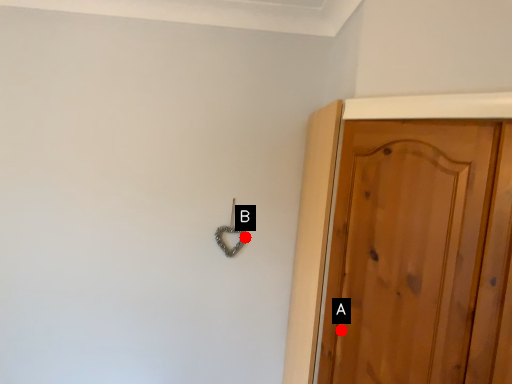
Question: Two points are circled on the image, labeled by A and B beside each circle. Which point is further to the camera?

Choices:
 (A) A is further
 (B) B is further

Answer: (B)